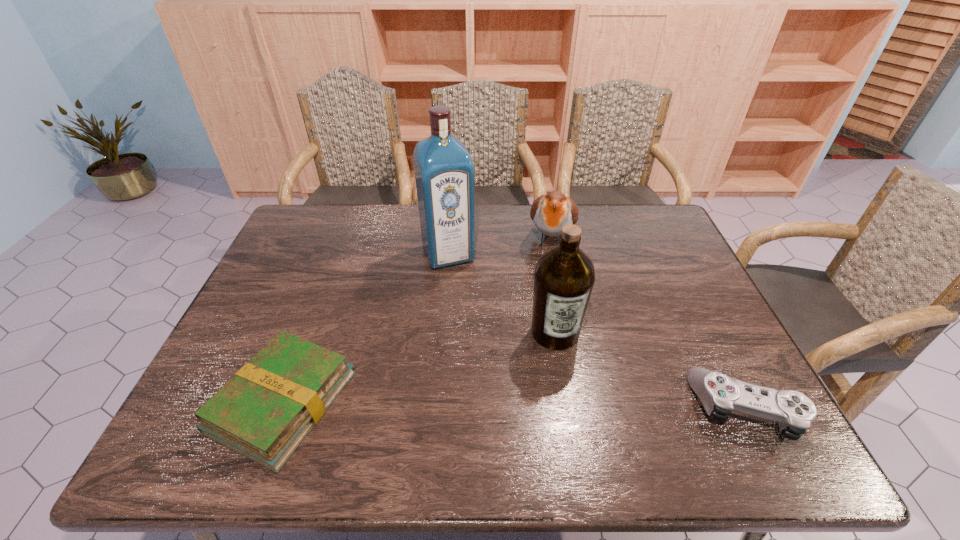
You are a GUI agent. You are given a task and a screenshot of the screen. Output one action in this format:
    pyautogui.click(x=<x>, y=<y>)
    Task: Click on the control located in the near edge section of the desktop
    The width and height of the screenshot is (960, 540).
    Given the screenshot: What is the action you would take?
    pyautogui.click(x=720, y=394)

The image size is (960, 540). I want to click on object that is at the left edge, so click(x=264, y=412).

Identify the location of object that is at the right edge. The width and height of the screenshot is (960, 540). (720, 394).

This screenshot has width=960, height=540. I want to click on object at the near left corner, so click(264, 412).

This screenshot has width=960, height=540. Find the location of `object that is at the near right corner`. object that is at the near right corner is located at coordinates 720,394.

The height and width of the screenshot is (540, 960). I want to click on free spot at the far edge of the desktop, so click(603, 244).

Where is `vacant space at the near edge of the desktop`? This screenshot has height=540, width=960. vacant space at the near edge of the desktop is located at coordinates (397, 400).

Where is `vacant space at the left edge`? The height and width of the screenshot is (540, 960). vacant space at the left edge is located at coordinates (271, 302).

You are a GUI agent. You are given a task and a screenshot of the screen. Output one action in this format:
    pyautogui.click(x=<x>, y=<y>)
    Task: Click on the vacant space at the far left corner of the desktop
    This screenshot has width=960, height=540.
    Given the screenshot: What is the action you would take?
    pyautogui.click(x=329, y=240)

Identify the location of vacant space that's between the liquor and the book. The height and width of the screenshot is (540, 960). (366, 328).